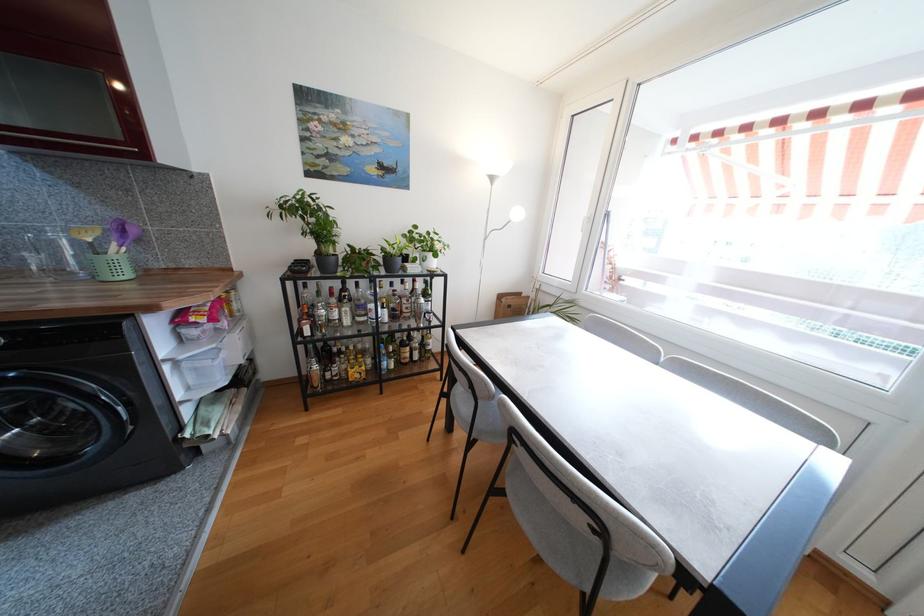
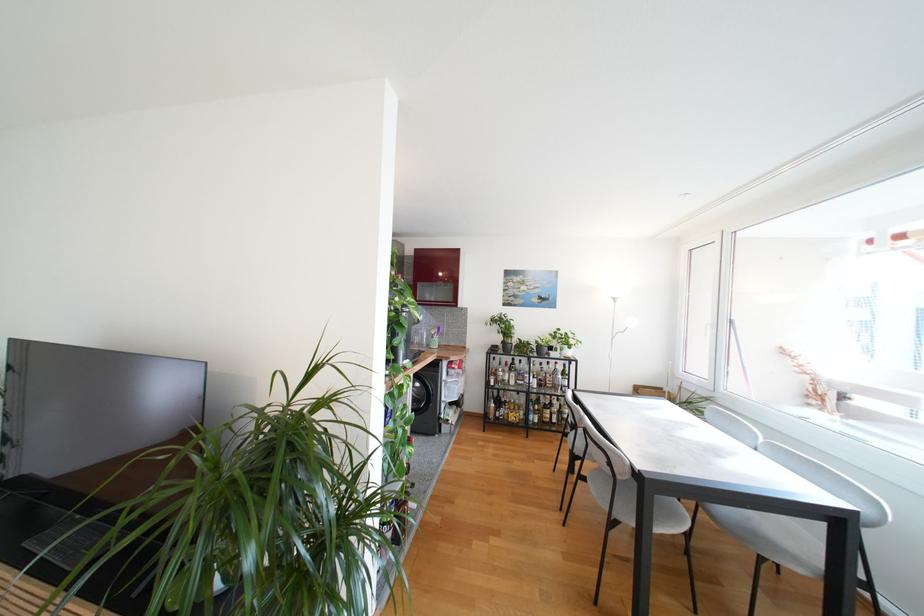
Where in the second image is the point corresponding to point (311, 296) from the first image?

(497, 366)